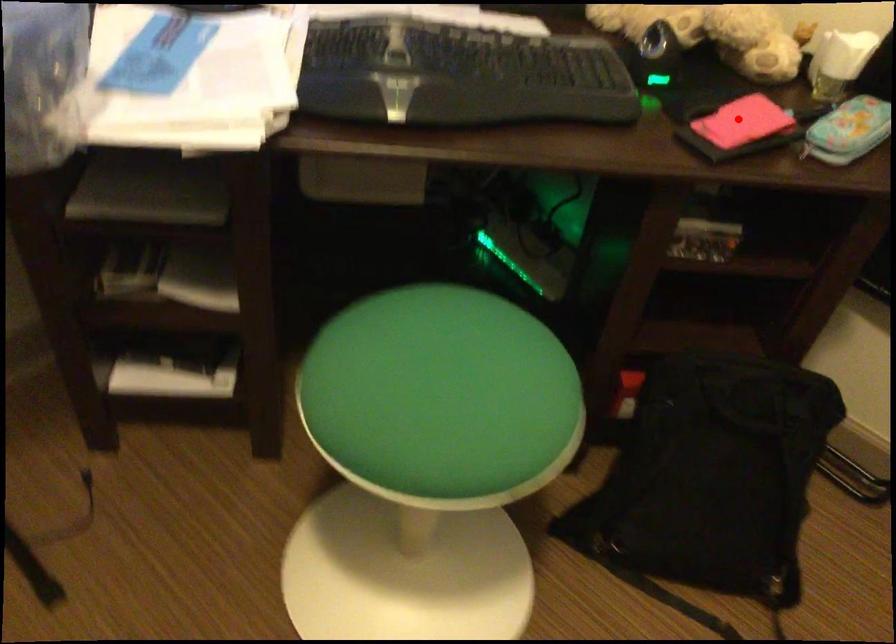
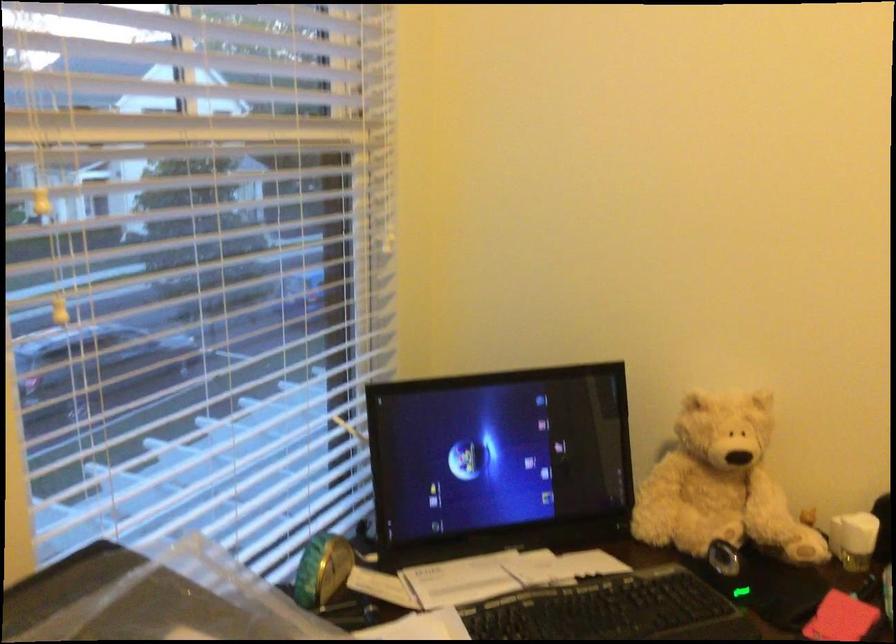
Locate, in the second image, the point that corresponds to the highlighted location in the first image.

(840, 618)